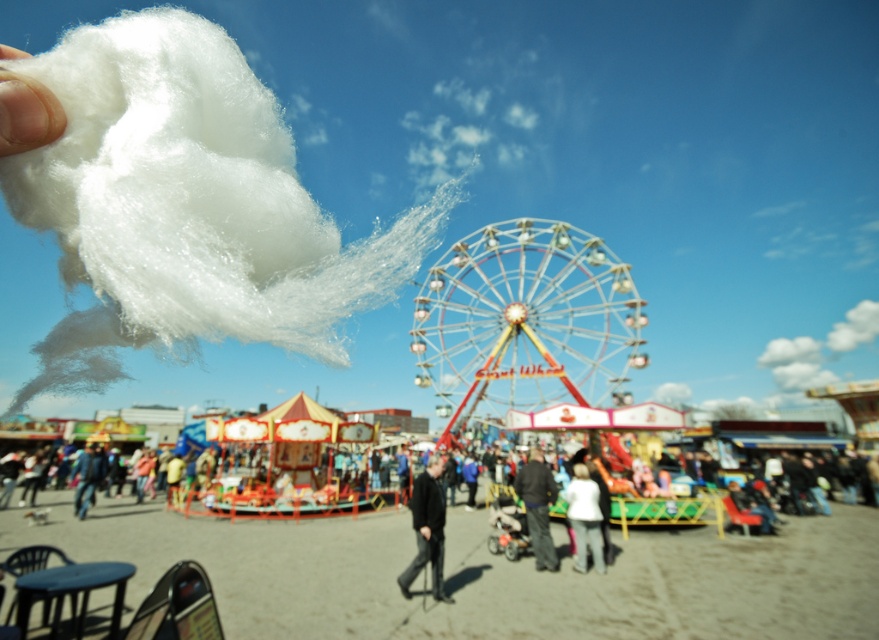
Who is more forward, (5, 77) or (597, 538)?

Point (5, 77) is in front.

Which is more to the right, white fluffy cotton at upper left or white cotton candy at lower center?

From the viewer's perspective, white cotton candy at lower center appears more on the right side.

You are a GUI agent. You are given a task and a screenshot of the screen. Output one action in this format:
    pyautogui.click(x=<x>, y=<y>)
    Task: Click on the white fluffy cotton at upper left
    The image size is (879, 640).
    Given the screenshot: What is the action you would take?
    [26, 113]

Between metallic shiny ferris wheel at center and dark gray fabric at center, which one has more height?

Standing taller between the two is metallic shiny ferris wheel at center.

Does point (535, 275) lie in front of point (527, 522)?

That is False.

The image size is (879, 640). I want to click on metallic shiny ferris wheel at center, so click(x=527, y=321).

Does metallic shiny ferris wheel at center have a greater width compared to white fluffy cotton at upper left?

Yes, metallic shiny ferris wheel at center is wider than white fluffy cotton at upper left.

Which is in front, point (458, 396) or point (9, 83)?

Point (9, 83)

Between point (620, 368) and point (40, 134), which one is positioned behind?

The point (620, 368) is more distant.

In order to click on metallic shiny ferris wheel at center in this screenshot , I will do `click(527, 321)`.